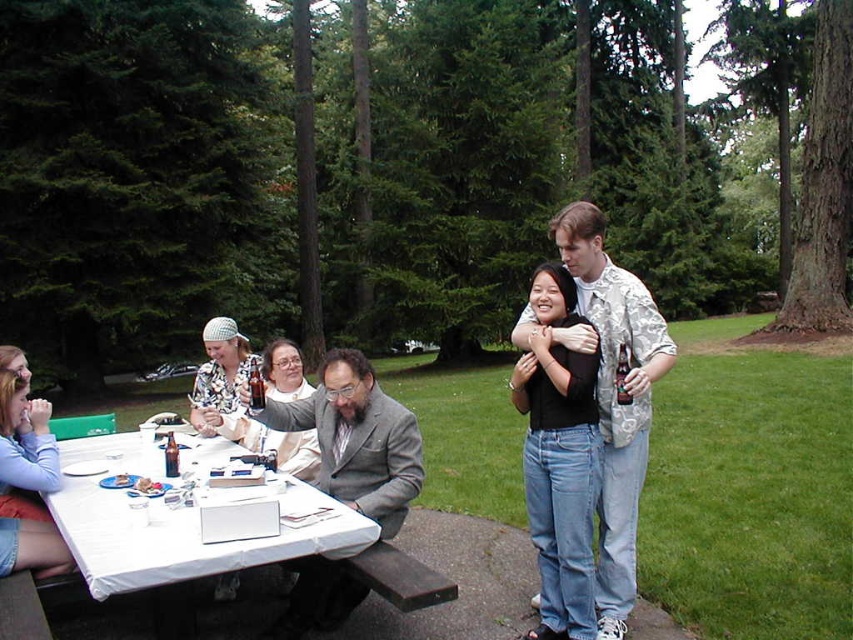
You are standing at the picnic table in the park. There is a point marked at coordinates (618, 536). What object is located at that point?

The point at coordinates (618, 536) corresponds to the matte gray suit at center.

You are organizing a small gathering and need to place a gray wool suit at center on the table. Given the white plastic table at lower left, will the suit fit on the table?

The white plastic table at lower left is larger in size than the gray wool suit at center, so the suit will fit on the table.